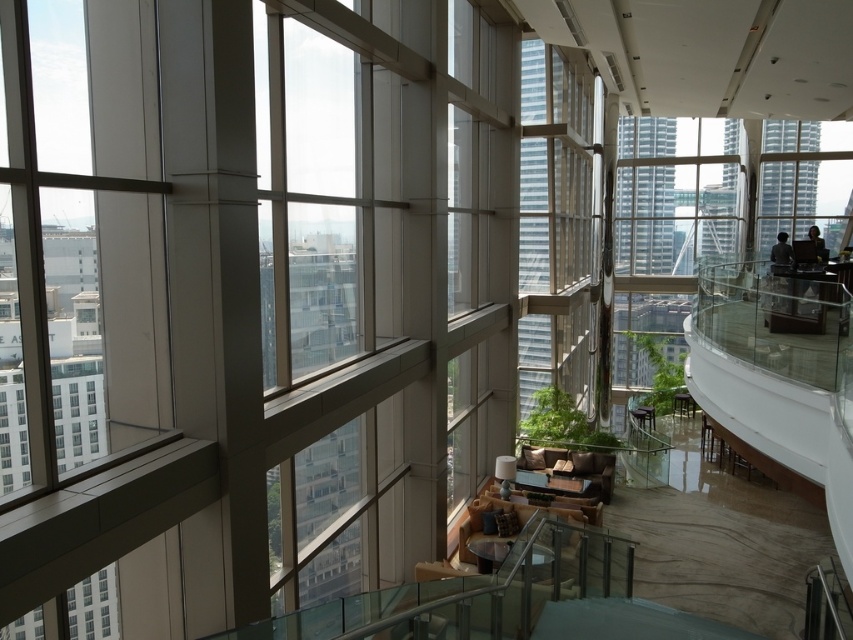
You are standing in the modern interior space and notice two items at the upper right corner. Which one is closer to you between the dark hair at upper right and the dark brown leather jacket at upper right?

The dark hair at upper right is closer to you as it is positioned in front of the dark brown leather jacket at upper right.

You are an interior designer planning to hang a large painting that is 2 meters tall. You have two options for placement in the scene described. The first option is to place it on the transparent glass window at lower left, and the second option is to place it on the dark brown leather jacket at upper right. Based on the height of these objects, which location would allow the painting to fit without exceeding the height of the object it is placed on?

The transparent glass window at lower left is taller than the dark brown leather jacket at upper right. Therefore, placing the large painting that is 2 meters tall on the transparent glass window at lower left would be the better option since it has sufficient height to accommodate the painting without exceeding its own height.